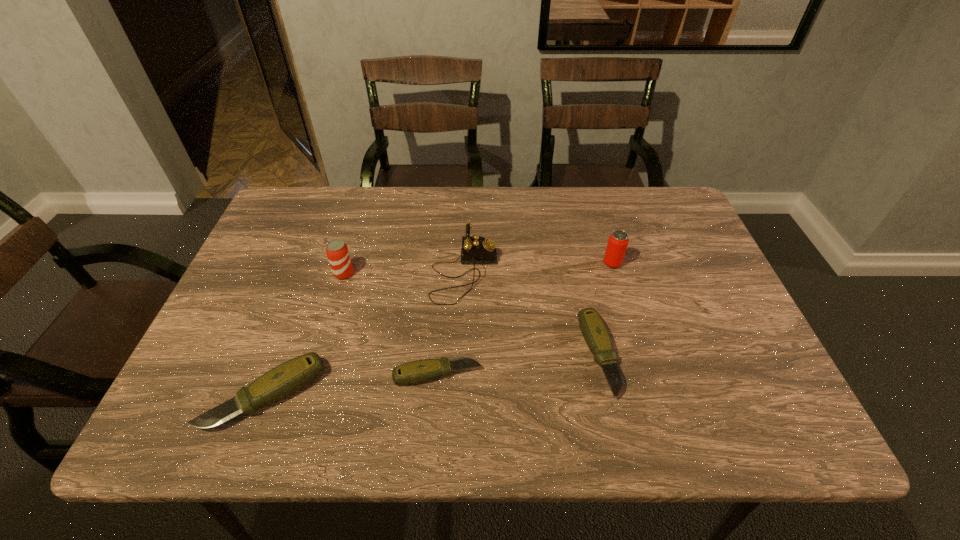
This screenshot has height=540, width=960. Find the location of `the leftmost pocketknife`. the leftmost pocketknife is located at coordinates (291, 376).

Where is `the second pocketknife from right to left`? the second pocketknife from right to left is located at coordinates (419, 371).

Where is `the shortest pocketknife`? the shortest pocketknife is located at coordinates (x=419, y=371).

Identify the location of the second tallest pocketknife. (596, 335).

This screenshot has height=540, width=960. Find the location of `the rightmost pocketknife`. the rightmost pocketknife is located at coordinates (596, 335).

I want to click on the rightmost object, so click(618, 241).

The width and height of the screenshot is (960, 540). Identify the location of the left beer can. (337, 252).

I want to click on telephone, so click(x=475, y=249).

What are the coordinates of `vacant space situated 0.050m on the back of the leftmost pocketknife` in the screenshot? It's located at (285, 342).

I want to click on vacant point located on the back of the shortest pocketknife, so click(x=445, y=268).